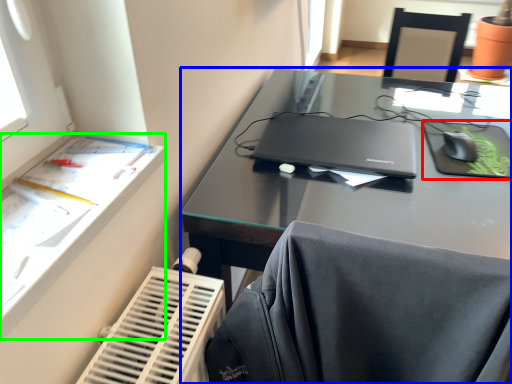
Question: Which object is the closest to the tablet computer (highlighted by a red box)? Choose among these: desk (highlighted by a blue box) or writing desk (highlighted by a green box).

Choices:
 (A) desk
 (B) writing desk

Answer: (A)